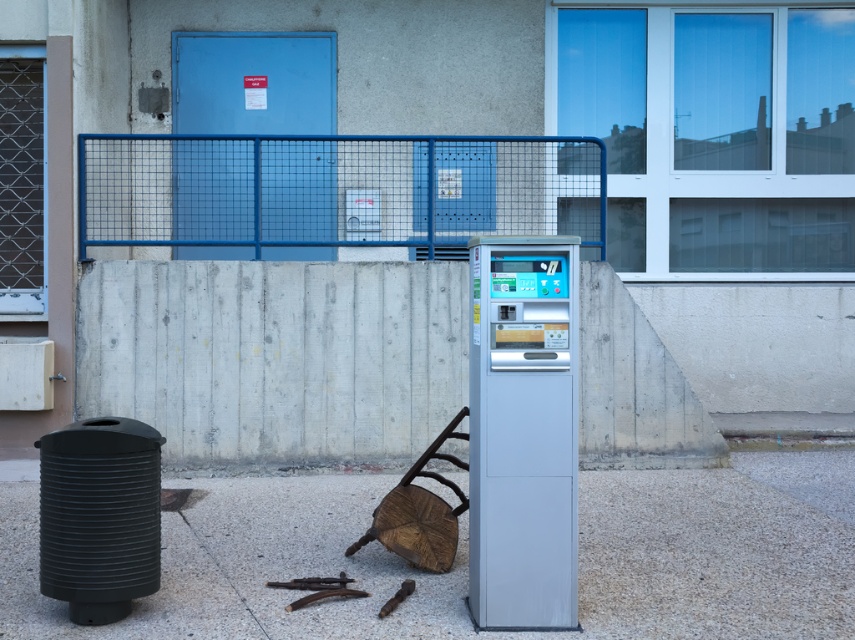
You are a delivery person who needs to move a 5 meter long ladder from the satin silver machine at center to the blue wire mesh fence at upper center. Can you move the ladder without tilting it?

The distance between the satin silver machine at center and the blue wire mesh fence at upper center is 4.76 meters. Since the ladder is 5 meters long, it is longer than the available space. Therefore, you cannot move the ladder horizontally without tilting it.

You are a delivery person trying to park your bike between the gray concrete pavement at center and the blue wire mesh fence at upper center. Which side should you position your bike closer to ensure it fits within the space?

The gray concrete pavement at center has a lesser width compared to the blue wire mesh fence at upper center. Therefore, you should position your bike closer to the gray concrete pavement at center to ensure it fits within the available space.